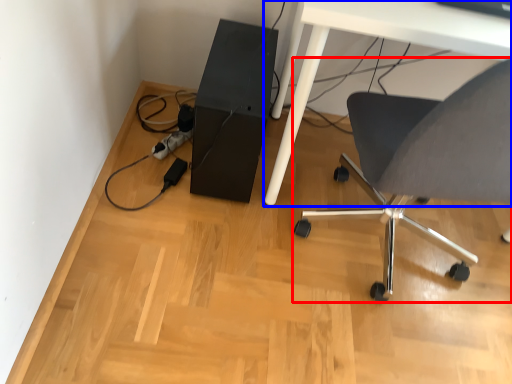
Question: Which object is further to the camera taking this photo, chair (highlighted by a red box) or table (highlighted by a blue box)?

Choices:
 (A) chair
 (B) table

Answer: (B)